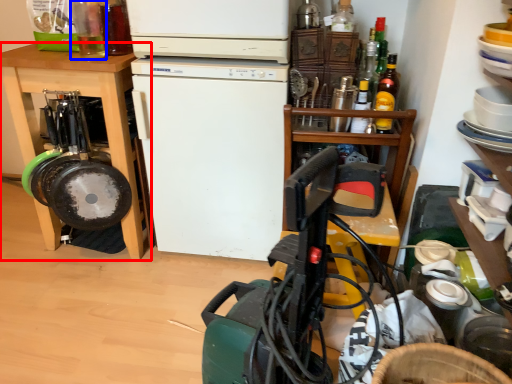
Question: Which of the following is the closest to the observer, cabinetry (highlighted by a red box) or bottle (highlighted by a blue box)?

Choices:
 (A) cabinetry
 (B) bottle

Answer: (B)